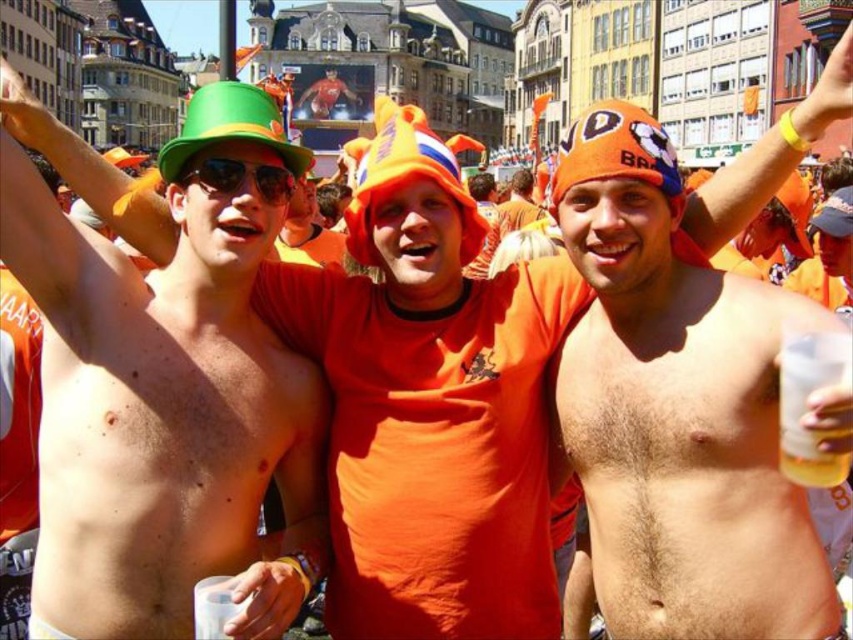
Question: Where is shiny plastic cup at upper left located in relation to green matte/glossy hat at upper left in the image?

Choices:
 (A) above
 (B) below

Answer: (B)

Question: Where is shiny plastic cup at upper left located in relation to green matte/glossy hat at upper left in the image?

Choices:
 (A) left
 (B) right

Answer: (A)

Question: Among these objects, which one is nearest to the camera?

Choices:
 (A) green matte/glossy hat at upper left
 (B) shiny plastic cup at upper left

Answer: (B)

Question: Is shiny plastic cup at upper left smaller than green matte/glossy hat at upper left?

Choices:
 (A) no
 (B) yes

Answer: (A)